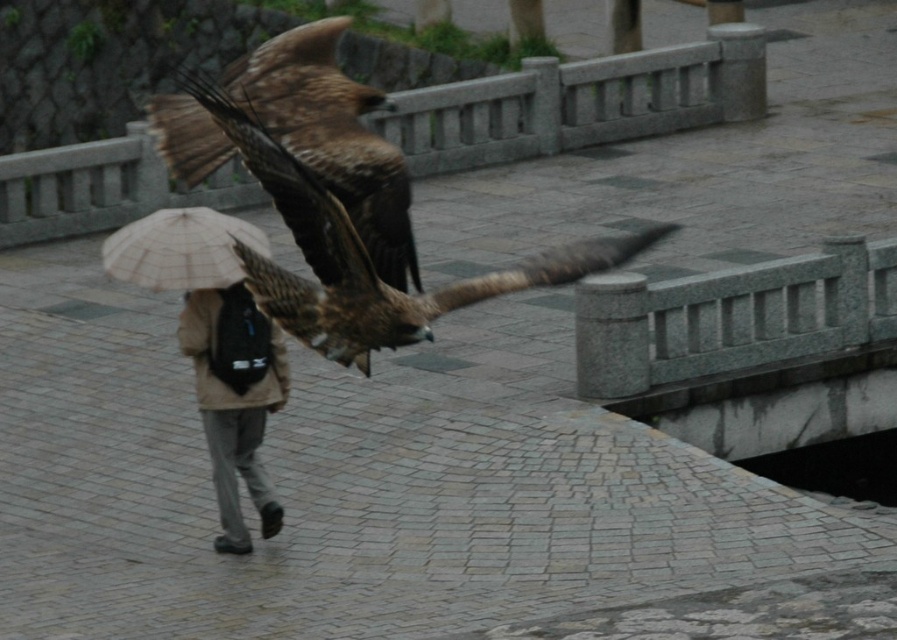
Question: Which point appears farthest from the camera in this image?

Choices:
 (A) (193, 278)
 (B) (319, 218)
 (C) (328, 58)

Answer: (A)

Question: Estimate the real-world distances between objects in this image. Which object is closer to the beige fabric umbrella at center?

Choices:
 (A) brown feathered eagle at center
 (B) brown feathered falcon at upper center

Answer: (A)

Question: Can you confirm if brown feathered falcon at upper center is positioned to the left of beige fabric umbrella at center?

Choices:
 (A) no
 (B) yes

Answer: (A)

Question: Is brown feathered eagle at center to the left of beige fabric umbrella at center from the viewer's perspective?

Choices:
 (A) no
 (B) yes

Answer: (A)

Question: Which point appears closest to the camera in this image?

Choices:
 (A) (379, 316)
 (B) (306, 88)

Answer: (B)

Question: Considering the relative positions of brown feathered eagle at center and beige fabric umbrella at center in the image provided, where is brown feathered eagle at center located with respect to beige fabric umbrella at center?

Choices:
 (A) right
 (B) left

Answer: (A)